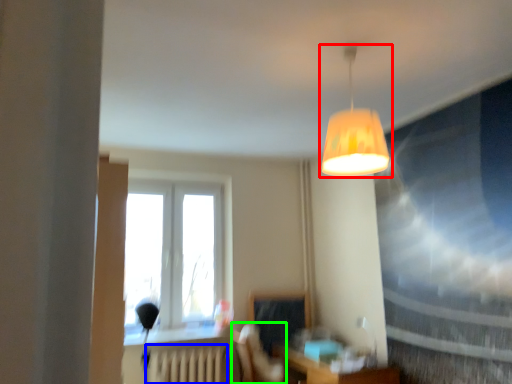
Question: Based on their relative distances, which object is nearer to lamp (highlighted by a red box)? Choose from radiator (highlighted by a blue box) and swivel chair (highlighted by a green box).

Choices:
 (A) radiator
 (B) swivel chair

Answer: (B)